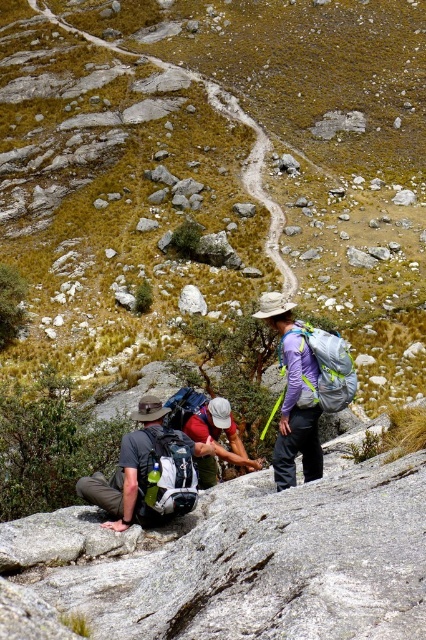
Between point (368, 29) and point (187, 304), which one is positioned behind?

The point (368, 29) is more distant.

Is grassy hillside at upper center further to camera compared to white smooth rock at center?

No, it is in front of white smooth rock at center.

Is point (215, 35) closer to viewer compared to point (201, 307)?

No, it is behind (201, 307).

The height and width of the screenshot is (640, 426). In order to click on grassy hillside at upper center in this screenshot , I will do `click(213, 172)`.

Who is positioned more to the right, matte gray backpack at lower left or white smooth rock at center?

Positioned to the right is matte gray backpack at lower left.

Is point (120, 496) closer to camera compared to point (181, 308)?

Yes.

Does point (138, 417) lie behind point (203, 298)?

No.

I want to click on matte gray backpack at lower left, so click(146, 470).

Can you confirm if grassy hillside at upper center is wider than matte gray backpack at lower left?

Correct, the width of grassy hillside at upper center exceeds that of matte gray backpack at lower left.

Describe the element at coordinates (213, 172) in the screenshot. This screenshot has width=426, height=640. I see `grassy hillside at upper center` at that location.

At what (x,y) coordinates should I click in order to perform the action: click on grassy hillside at upper center. Please return your answer as a coordinate pair (x, y). This screenshot has height=640, width=426. Looking at the image, I should click on pos(213,172).